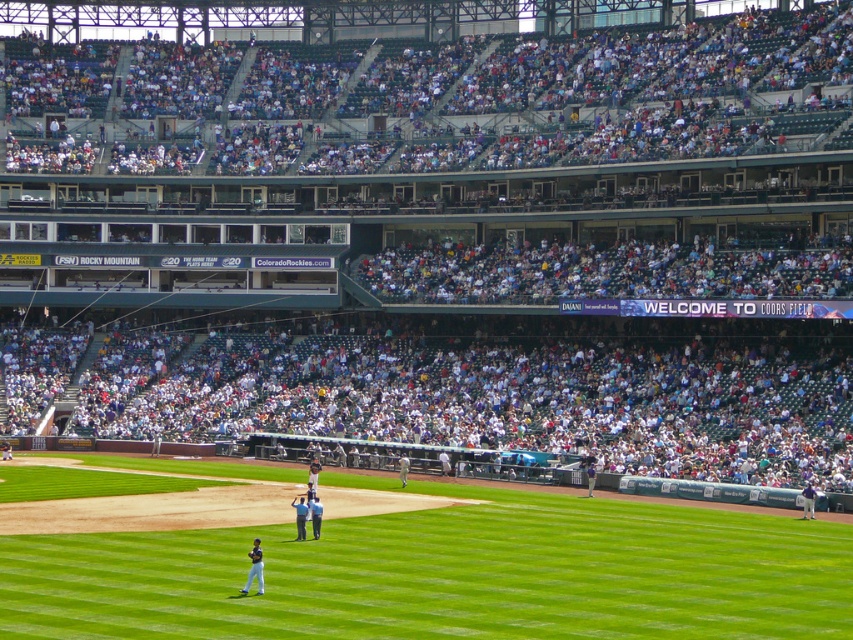
Question: Observing the image, what is the correct spatial positioning of green grass at center in reference to dark blue uniform at lower left?

Choices:
 (A) left
 (B) right

Answer: (B)

Question: Is green grass at center further to camera compared to dark blue uniform at lower left?

Choices:
 (A) no
 (B) yes

Answer: (A)

Question: Which object is the closest to the light blue uniform at center?

Choices:
 (A) blue uniformed man at center
 (B) dark blue uniform at lower left
 (C) green grass at center

Answer: (A)

Question: Which object is positioned closest to the dark blue uniform at lower left?

Choices:
 (A) blue uniformed man at center
 (B) light blue uniform at center
 (C) green grass at center

Answer: (A)

Question: Is dark blue uniform at lower left thinner than light blue uniform at center?

Choices:
 (A) yes
 (B) no

Answer: (A)

Question: Which of the following is the farthest from the observer?

Choices:
 (A) light blue uniform at center
 (B) green grass at center
 (C) blue uniformed man at center

Answer: (C)